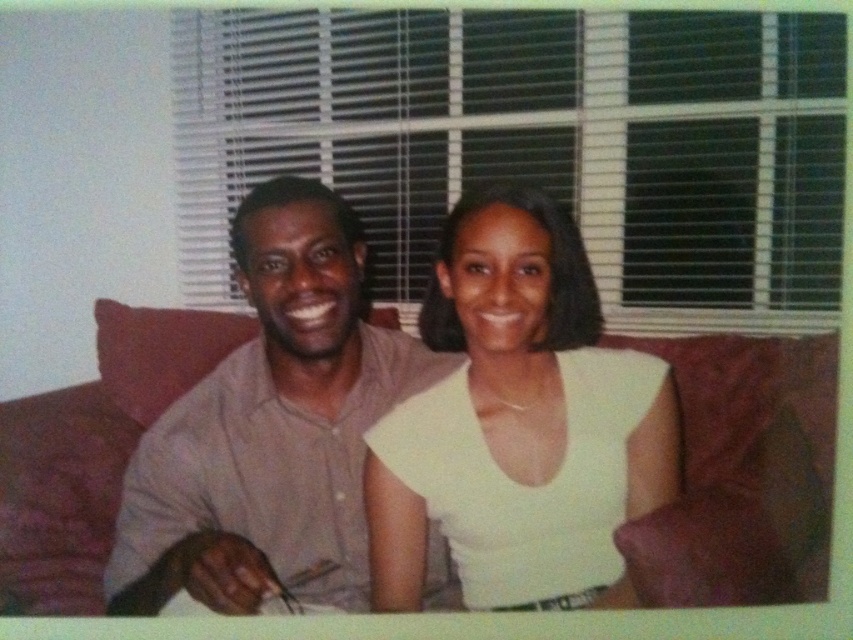
Question: Is brown leather couch at center bigger than matte gray shirt at center?

Choices:
 (A) yes
 (B) no

Answer: (B)

Question: Is brown leather couch at center thinner than matte gray shirt at center?

Choices:
 (A) no
 (B) yes

Answer: (A)

Question: Among these points, which one is farthest from the camera?

Choices:
 (A) (13, 404)
 (B) (242, 356)

Answer: (A)

Question: Among these objects, which one is farthest from the camera?

Choices:
 (A) white matte shirt at center
 (B) matte gray shirt at center
 (C) brown leather couch at center

Answer: (A)

Question: Which object is positioned closest to the brown leather couch at center?

Choices:
 (A) matte gray shirt at center
 (B) white matte shirt at center

Answer: (B)

Question: Is brown leather couch at center closer to the viewer compared to matte gray shirt at center?

Choices:
 (A) yes
 (B) no

Answer: (A)